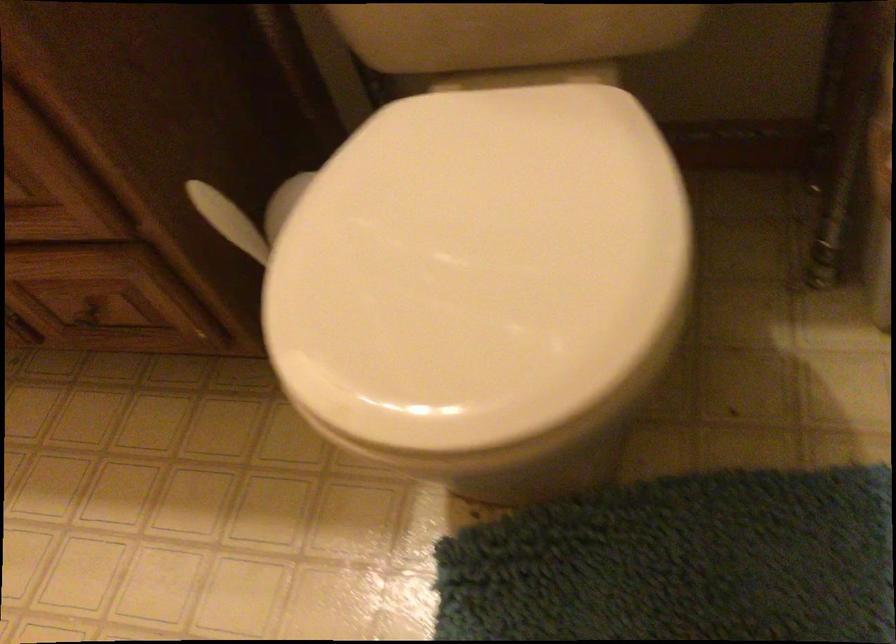
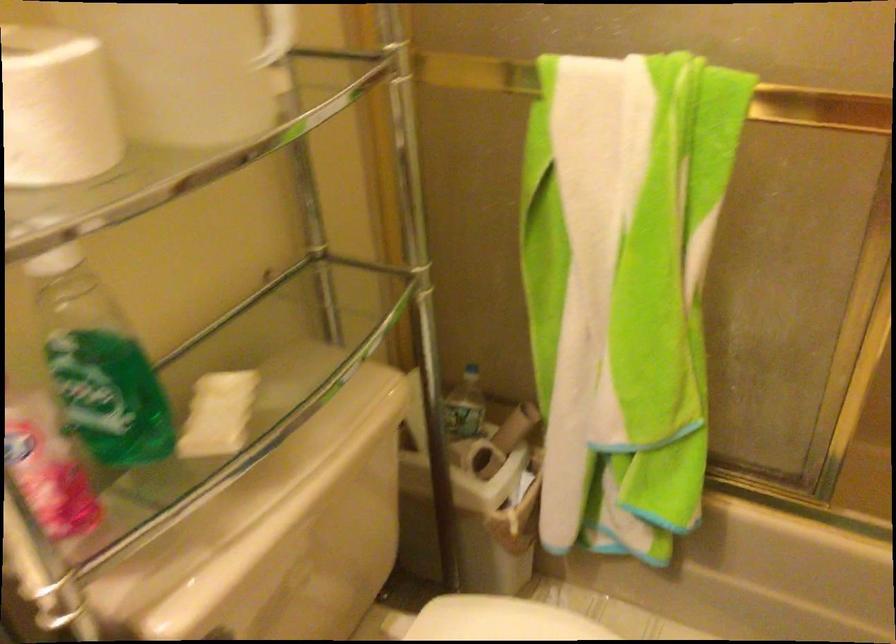
Question: The camera is either moving clockwise (left) or counter-clockwise (right) around the object. The first image is from the beginning of the video and the second image is from the end. Is the camera moving left or right when shooting the video?

Choices:
 (A) Left
 (B) Right

Answer: (A)